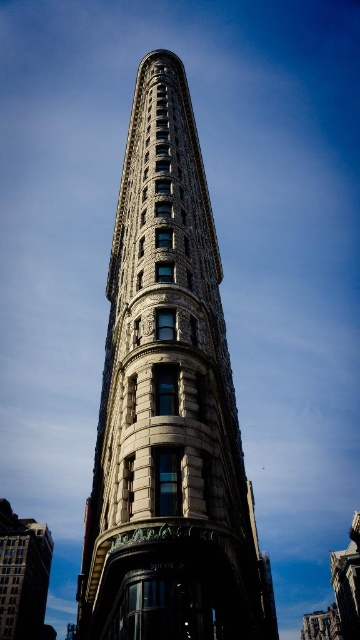
You are a photographer planning to capture the iconic Flatiron Building and another nearby structure. You notice the stone textured building at center and the white stone building at lower left. Which of these two buildings has a narrower width?

→ The stone textured building at center has a lesser width compared to the white stone building at lower left, so the stone textured building at center is narrower in width.

You are standing at the entrance of the park and want to take a photo of the stone textured building at center. According to the coordinates provided, in which direction should you position yourself relative to the building to capture it best?

The stone textured building at center is located at point coordinates, so you should position yourself facing the building directly as it is centered in the image.

You are a tourist standing in front of the Flatiron Building and want to take a photo that includes both the stone textured building at center and the white stone building at lower left. Based on their sizes, which building should you focus on to ensure both fit in the frame?

The stone textured building at center is smaller than the white stone building at lower left, so you should focus on the white stone building at lower left to ensure both fit in the frame since it is larger and can accommodate the smaller building in the composition.